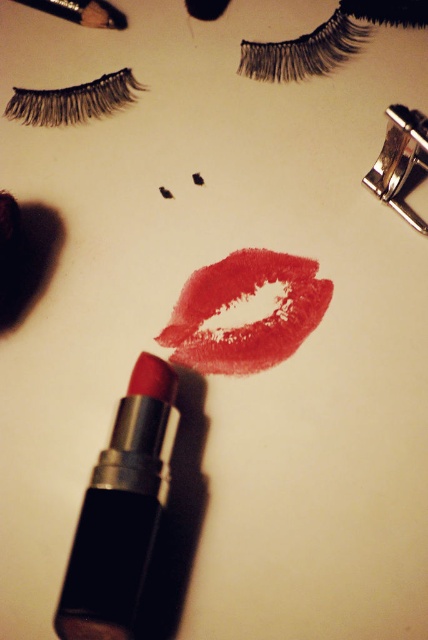
Question: Is black synthetic false eyelashes at upper left positioned at the back of metallic silver brush at upper left?

Choices:
 (A) yes
 (B) no

Answer: (B)

Question: Can you confirm if matte black lipstick at lower left is wider than shiny red lipstick at center?

Choices:
 (A) no
 (B) yes

Answer: (A)

Question: Which object appears closest to the camera in this image?

Choices:
 (A) black synthetic false eyelashes at upper left
 (B) shiny red lipstick at center

Answer: (B)

Question: Which point is farther from the camera taking this photo?

Choices:
 (A) (73, 589)
 (B) (327, 298)

Answer: (B)

Question: Where is shiny red lipstick at center located in relation to black synthetic false eyelashes at upper left in the image?

Choices:
 (A) below
 (B) above

Answer: (A)

Question: Which point is closer to the camera?

Choices:
 (A) shiny red lipstick at center
 (B) metallic silver brush at upper left

Answer: (A)